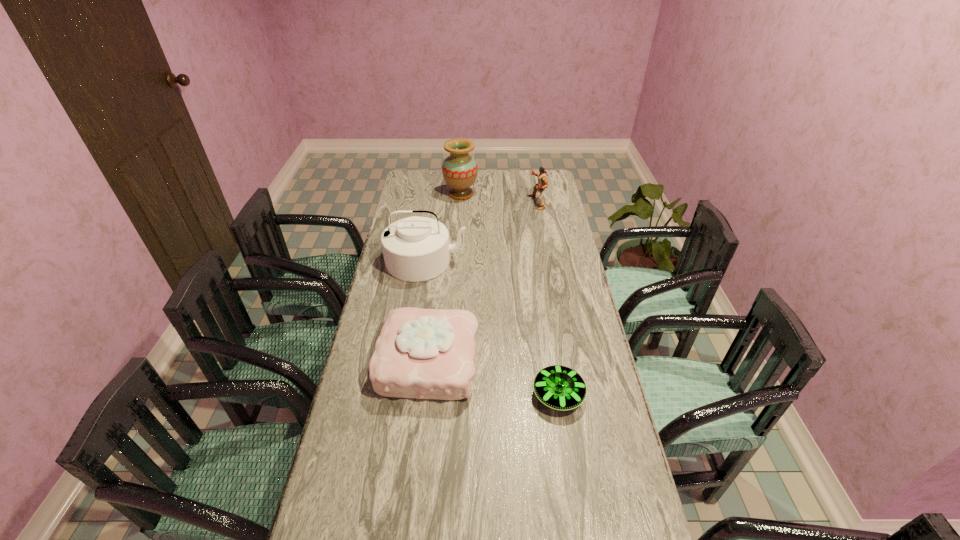
You are a GUI agent. You are given a task and a screenshot of the screen. Output one action in this format:
    pyautogui.click(x=<x>, y=<y>)
    Task: Click on the vase
    
    Given the screenshot: What is the action you would take?
    pyautogui.click(x=459, y=170)

Find the location of a particular element. kettle is located at coordinates (415, 249).

You are a GUI agent. You are given a task and a screenshot of the screen. Output one action in this format:
    pyautogui.click(x=<x>, y=<y>)
    Task: Click on the third shortest object
    
    Given the screenshot: What is the action you would take?
    pyautogui.click(x=538, y=188)

Image resolution: width=960 pixels, height=540 pixels. Find the location of `the second shortest object`. the second shortest object is located at coordinates (421, 353).

The width and height of the screenshot is (960, 540). I want to click on saucer, so click(559, 387).

This screenshot has width=960, height=540. Identify the location of vacant space located 0.330m on the right of the vase. click(543, 194).

Locate an element on the screen. The image size is (960, 540). vacant space positioned 0.240m on the spout of the third farthest object is located at coordinates (416, 328).

Find the location of a particular element. free space located on the front-facing side of the puncher is located at coordinates (447, 202).

Where is `vacant area located 0.400m on the front-facing side of the puncher`? vacant area located 0.400m on the front-facing side of the puncher is located at coordinates (447, 202).

Where is `free space located on the front-facing side of the puncher`? free space located on the front-facing side of the puncher is located at coordinates (515, 202).